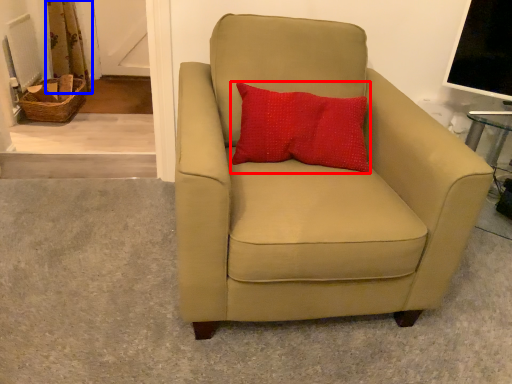
Question: Which point is further to the camera, pillow (highlighted by a red box) or curtain (highlighted by a blue box)?

Choices:
 (A) pillow
 (B) curtain

Answer: (B)